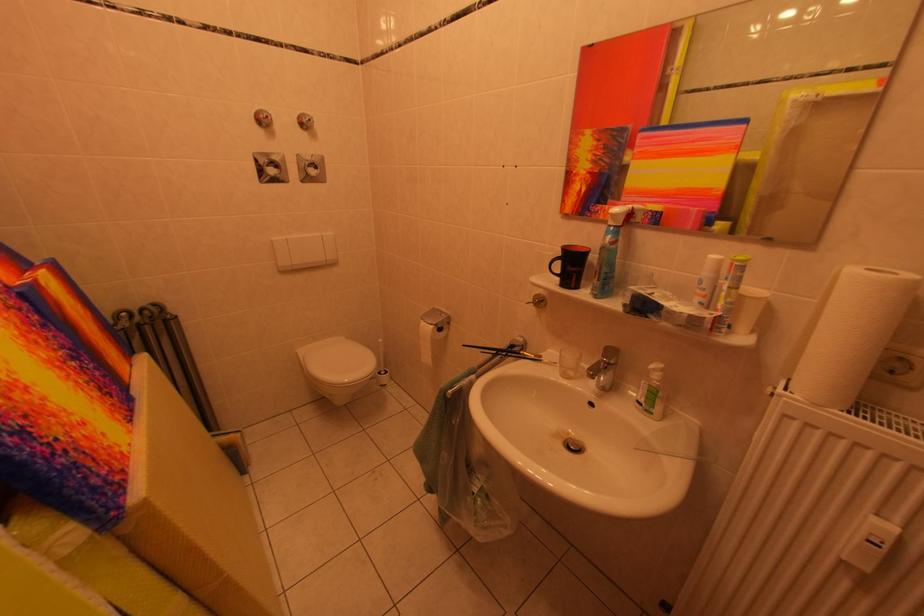
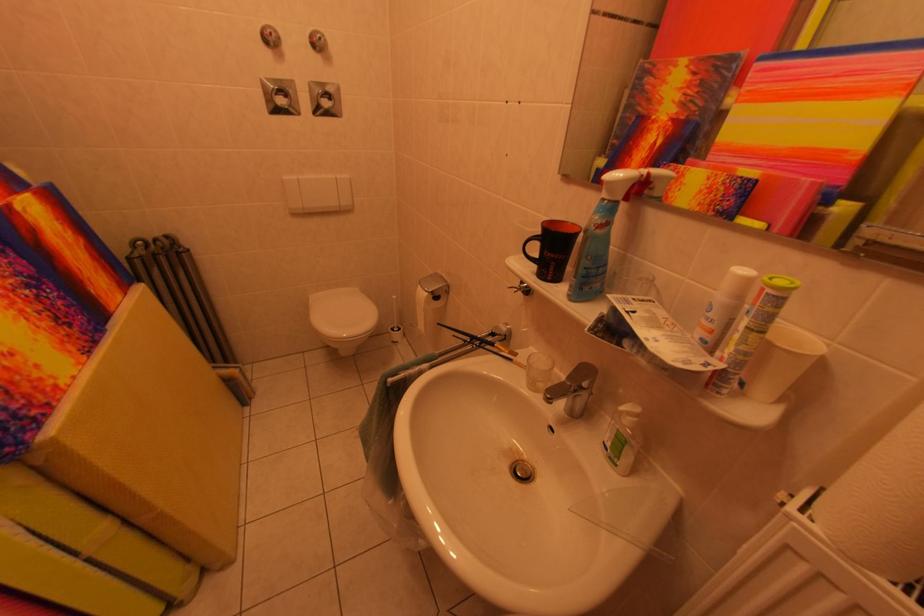
Find the pixel in the second image that matches (x=747, y=292) in the first image.

(773, 336)